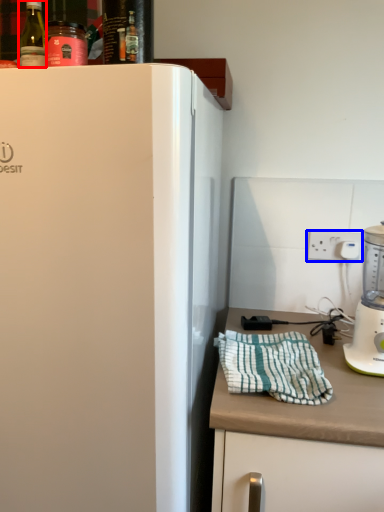
Question: Which point is further to the camera, bottle (highlighted by a red box) or electric outlet (highlighted by a blue box)?

Choices:
 (A) bottle
 (B) electric outlet

Answer: (B)